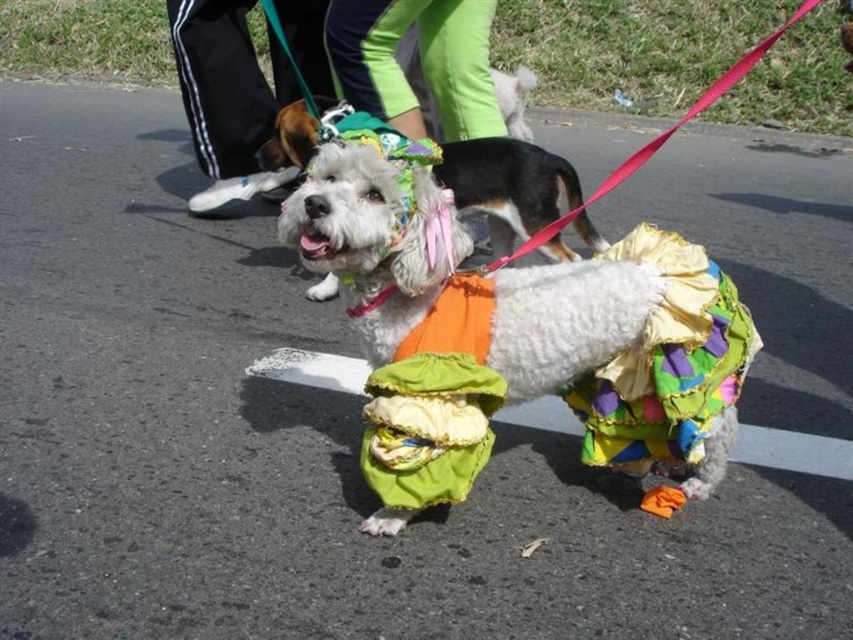
Question: Which object appears closest to the camera in this image?

Choices:
 (A) black fabric pants at upper left
 (B) white fluffy dog at center
 (C) green fabric pants at center

Answer: (B)

Question: Observing the image, what is the correct spatial positioning of white fluffy dog at center in reference to green fabric pants at center?

Choices:
 (A) above
 (B) below

Answer: (B)

Question: Does black fabric pants at upper left come in front of green fabric pants at center?

Choices:
 (A) no
 (B) yes

Answer: (A)

Question: Which object appears closest to the camera in this image?

Choices:
 (A) black fabric pants at upper left
 (B) white fluffy dog at center

Answer: (B)

Question: Can you confirm if white fluffy dog at center is positioned above green fabric pants at center?

Choices:
 (A) no
 (B) yes

Answer: (A)

Question: Which point is farther to the camera?

Choices:
 (A) green fabric pants at center
 (B) white fluffy dog at center
 (C) black fabric pants at upper left

Answer: (C)